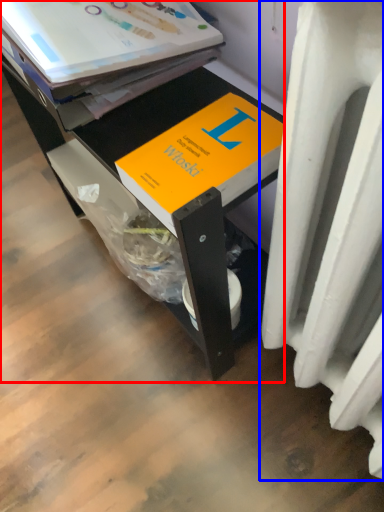
Question: Which point is closer to the camera, desk (highlighted by a red box) or heater (highlighted by a blue box)?

Choices:
 (A) desk
 (B) heater

Answer: (B)